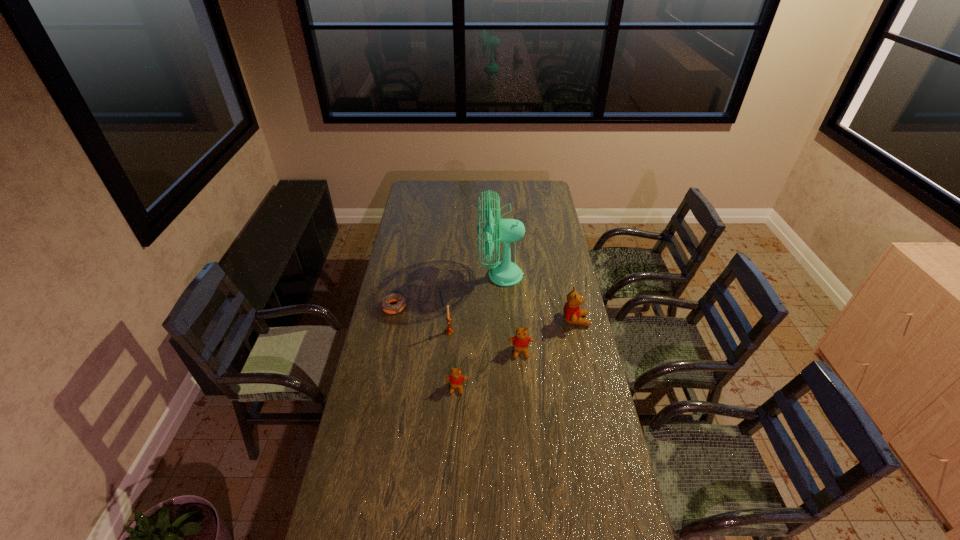
What are the coordinates of `the shortest teddy bear` in the screenshot? It's located at (456, 378).

Where is `the second shortest object`? Image resolution: width=960 pixels, height=540 pixels. the second shortest object is located at coordinates (456, 378).

Identify the location of the second farthest teddy bear. (521, 341).

The width and height of the screenshot is (960, 540). Find the location of `the third shortest object`. the third shortest object is located at coordinates (521, 341).

Locate an element on the screen. The height and width of the screenshot is (540, 960). the rightmost object is located at coordinates (572, 313).

Find the location of a particular element. the farthest teddy bear is located at coordinates (572, 313).

Identify the location of the shortest object. (395, 297).

At what (x,y) coordinates should I click in order to perform the action: click on doughnut. Please return your answer as a coordinate pair (x, y). Looking at the image, I should click on (395, 297).

At what (x,y) coordinates should I click in order to perform the action: click on fan. Please return your answer as a coordinate pair (x, y). The height and width of the screenshot is (540, 960). Looking at the image, I should click on (505, 273).

The height and width of the screenshot is (540, 960). I want to click on candle_holder, so click(448, 330).